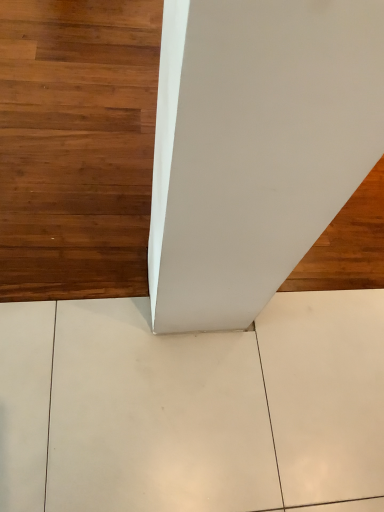
In order to click on wooden at left in this screenshot , I will do `click(76, 147)`.

The width and height of the screenshot is (384, 512). What do you see at coordinates (76, 147) in the screenshot?
I see `wooden at left` at bounding box center [76, 147].

What are the coordinates of `wooden at left` in the screenshot? It's located at (76, 147).